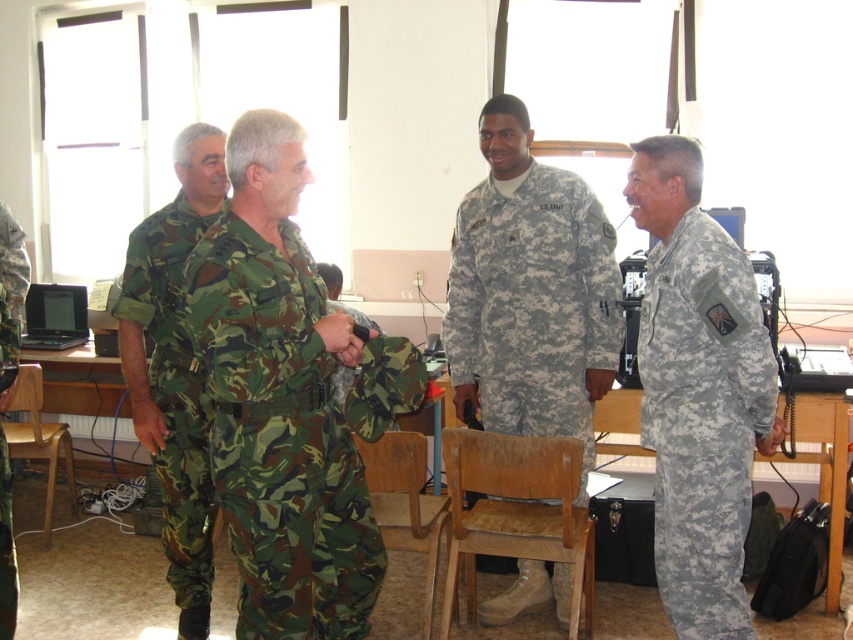
You are a photographer trying to capture a group photo of the camouflage fabric uniform at right and the wooden chair at lower left. Based on their sizes, which one should you focus on first to ensure they are in frame?

The camouflage fabric uniform at right is taller than the wooden chair at lower left, so you should focus on the camouflage fabric uniform at right first to ensure it fits in the frame.

In the scene shown: You are a photographer standing in the room where the image was taken. You need to take a photo of both the camouflage fabric uniform at right and the camouflage fabric uniform at left. Which one should you focus on first to ensure both are in frame?

The camouflage fabric uniform at right is shorter than the camouflage fabric uniform at left. Therefore, you should focus on the camouflage fabric uniform at left first to ensure both are in frame.

In the scene where four military personnel are in a discussion, where exactly is the camouflage fabric uniform at right located?

The camouflage fabric uniform at right is located at point 0.658 on the x axis and 0.825 on the y axis.